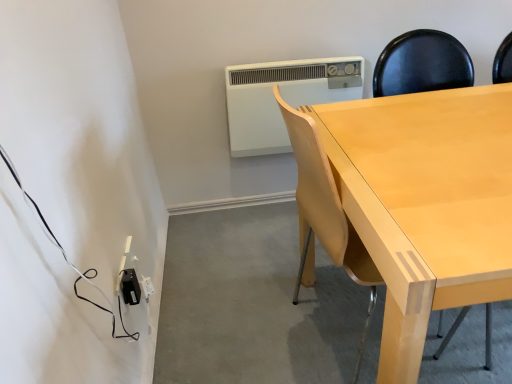
Question: Considering the relative sizes of black plastic power adapter at lower left and light wood chair at center in the image provided, is black plastic power adapter at lower left smaller than light wood chair at center?

Choices:
 (A) no
 (B) yes

Answer: (B)

Question: Is black plastic power adapter at lower left with light wood chair at center?

Choices:
 (A) no
 (B) yes

Answer: (A)

Question: From the image's perspective, does black plastic power adapter at lower left appear lower than light wood chair at center?

Choices:
 (A) yes
 (B) no

Answer: (A)

Question: From a real-world perspective, does black plastic power adapter at lower left sit lower than light wood chair at center?

Choices:
 (A) no
 (B) yes

Answer: (B)

Question: Is the position of black plastic power adapter at lower left more distant than that of light wood chair at center?

Choices:
 (A) yes
 (B) no

Answer: (A)

Question: Is black plastic power adapter at lower left oriented towards light wood chair at center?

Choices:
 (A) yes
 (B) no

Answer: (A)

Question: From a real-world perspective, is black plastic power adapter at lower left under white plastic air conditioning unit at upper center?

Choices:
 (A) yes
 (B) no

Answer: (A)

Question: Does black plastic power adapter at lower left have a lesser height compared to white plastic air conditioning unit at upper center?

Choices:
 (A) yes
 (B) no

Answer: (A)

Question: Considering the relative sizes of black plastic power adapter at lower left and white plastic air conditioning unit at upper center in the image provided, is black plastic power adapter at lower left wider than white plastic air conditioning unit at upper center?

Choices:
 (A) yes
 (B) no

Answer: (B)

Question: Is black plastic power adapter at lower left outside white plastic air conditioning unit at upper center?

Choices:
 (A) no
 (B) yes

Answer: (B)

Question: Could white plastic air conditioning unit at upper center be considered to be inside black plastic power adapter at lower left?

Choices:
 (A) no
 (B) yes

Answer: (A)

Question: Can you see black plastic power adapter at lower left touching white plastic air conditioning unit at upper center?

Choices:
 (A) no
 (B) yes

Answer: (A)

Question: Is white plastic air conditioning unit at upper center further to the viewer compared to black plastic power adapter at lower left?

Choices:
 (A) yes
 (B) no

Answer: (A)